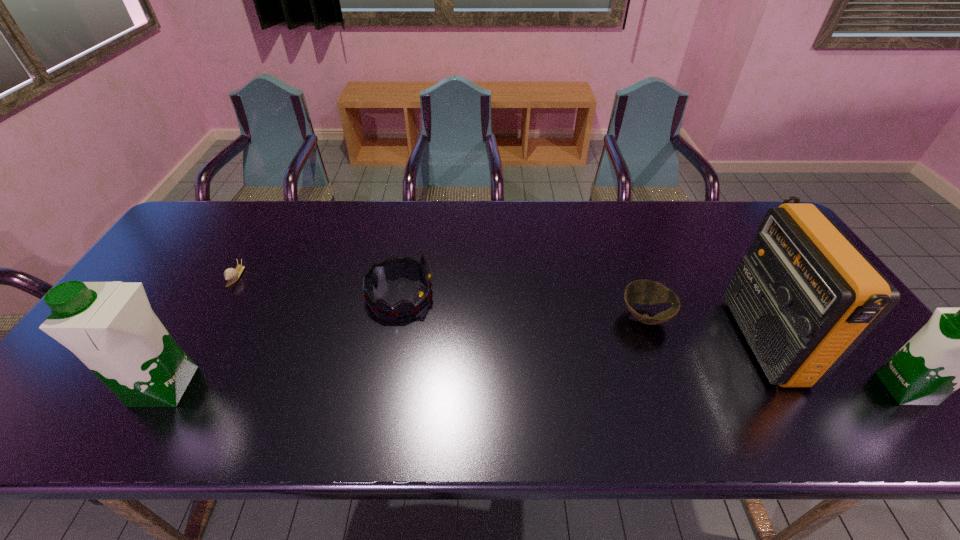
The height and width of the screenshot is (540, 960). Find the location of `the taller soya milk`. the taller soya milk is located at coordinates (110, 326).

This screenshot has height=540, width=960. I want to click on the shorter soya milk, so click(957, 348).

Image resolution: width=960 pixels, height=540 pixels. Identify the location of the right soya milk. (957, 348).

I want to click on the shortest object, so click(231, 275).

Identify the location of bowl. The height and width of the screenshot is (540, 960). (645, 292).

This screenshot has height=540, width=960. I want to click on the second shortest object, so click(x=645, y=292).

Where is `the third shortest object`? This screenshot has width=960, height=540. the third shortest object is located at coordinates coord(392,266).

Locate an element on the screen. the fourth object from right to left is located at coordinates (392, 266).

What are the coordinates of `radio receiver` in the screenshot? It's located at click(x=804, y=296).

Image resolution: width=960 pixels, height=540 pixels. Identify the location of vacant position located on the front-facing side of the shorter soya milk. (720, 389).